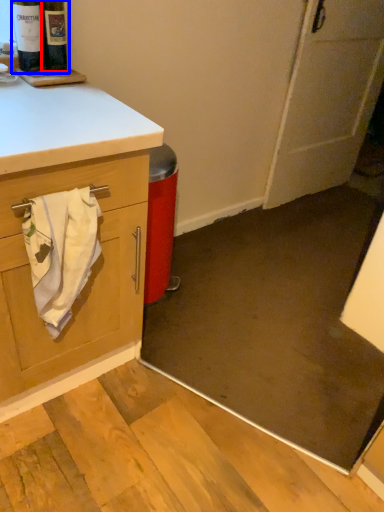
Question: Which point is further to the camera, wine bottle (highlighted by a red box) or beer bottle (highlighted by a blue box)?

Choices:
 (A) wine bottle
 (B) beer bottle

Answer: (A)